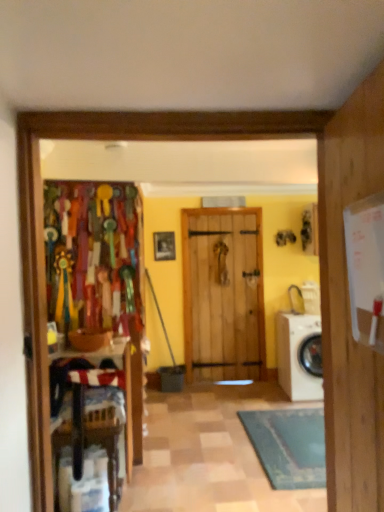
Question: Would you say wooden chair at left contains white glossy washing machine at lower right?

Choices:
 (A) no
 (B) yes

Answer: (A)

Question: Would you say wooden chair at left is outside white glossy washing machine at lower right?

Choices:
 (A) yes
 (B) no

Answer: (A)

Question: Can you confirm if wooden chair at left is smaller than white glossy washing machine at lower right?

Choices:
 (A) no
 (B) yes

Answer: (B)

Question: Is the depth of wooden chair at left greater than that of white glossy washing machine at lower right?

Choices:
 (A) no
 (B) yes

Answer: (A)

Question: From a real-world perspective, is wooden chair at left on white glossy washing machine at lower right?

Choices:
 (A) no
 (B) yes

Answer: (A)

Question: From a real-world perspective, is wooden frame at center above or below wooden chair at left?

Choices:
 (A) below
 (B) above

Answer: (B)

Question: Visually, is wooden frame at center positioned to the left or to the right of wooden chair at left?

Choices:
 (A) left
 (B) right

Answer: (B)

Question: Is wooden frame at center taller or shorter than wooden chair at left?

Choices:
 (A) short
 (B) tall

Answer: (A)

Question: Is wooden frame at center bigger or smaller than wooden chair at left?

Choices:
 (A) big
 (B) small

Answer: (B)

Question: From the image's perspective, is white glossy washing machine at lower right positioned above or below wooden chair at left?

Choices:
 (A) above
 (B) below

Answer: (A)

Question: Looking at the image, does white glossy washing machine at lower right seem bigger or smaller compared to wooden chair at left?

Choices:
 (A) small
 (B) big

Answer: (B)

Question: Would you say white glossy washing machine at lower right is inside or outside wooden chair at left?

Choices:
 (A) outside
 (B) inside

Answer: (A)

Question: Relative to wooden chair at left, is white glossy washing machine at lower right in front or behind?

Choices:
 (A) front
 (B) behind

Answer: (B)

Question: In the image, is white glossy washing machine at lower right positioned in front of or behind wooden frame at center?

Choices:
 (A) behind
 (B) front

Answer: (B)

Question: From the image's perspective, is white glossy washing machine at lower right located above or below wooden frame at center?

Choices:
 (A) above
 (B) below

Answer: (B)